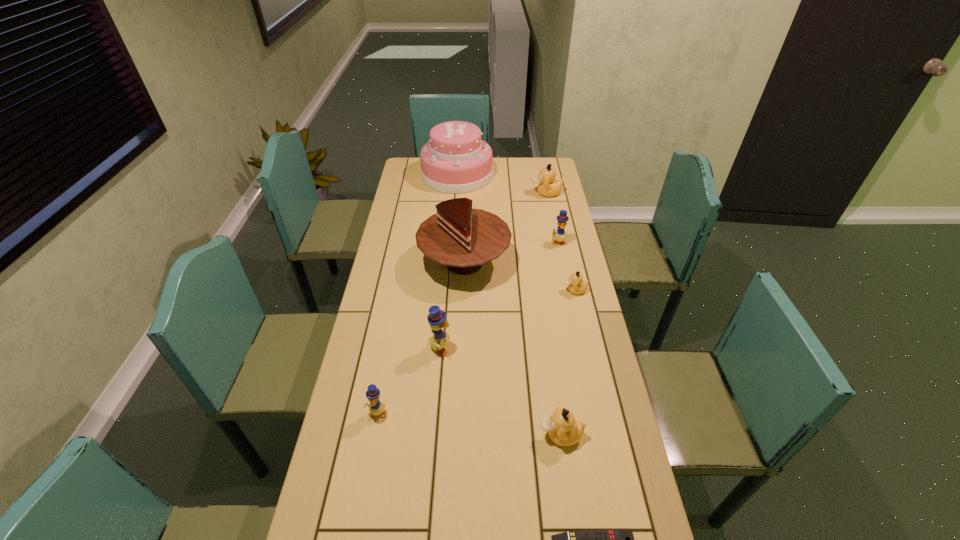
This screenshot has height=540, width=960. I want to click on cake present at the left edge, so click(x=463, y=238).

I want to click on duckling present at the left edge, so click(376, 407).

The image size is (960, 540). Identify the location of object present at the far left corner. (x=455, y=160).

Identify the location of blank space at the far edge of the desktop. (498, 158).

At what (x,y) coordinates should I click in order to perform the action: click on vacant area at the left edge. Please return your answer as a coordinate pair (x, y). Looking at the image, I should click on (390, 281).

Image resolution: width=960 pixels, height=540 pixels. In the image, there is a desktop. Find the location of `free space at the right edge`. free space at the right edge is located at coordinates (534, 206).

Find the location of `vacant space at the far left corner of the desktop`. vacant space at the far left corner of the desktop is located at coordinates (406, 180).

In the image, there is a desktop. At what (x,y) coordinates should I click in order to perform the action: click on vacant space at the far right corner. Please return your answer as a coordinate pair (x, y). The height and width of the screenshot is (540, 960). Looking at the image, I should click on (533, 166).

Identify the location of blank region between the second biggest yellow duckling and the cake. The image size is (960, 540). (512, 252).

The height and width of the screenshot is (540, 960). Find the location of `free space between the farthest duckling and the second nearest object`. free space between the farthest duckling and the second nearest object is located at coordinates (553, 314).